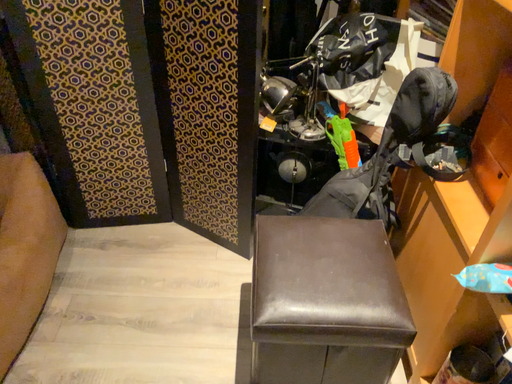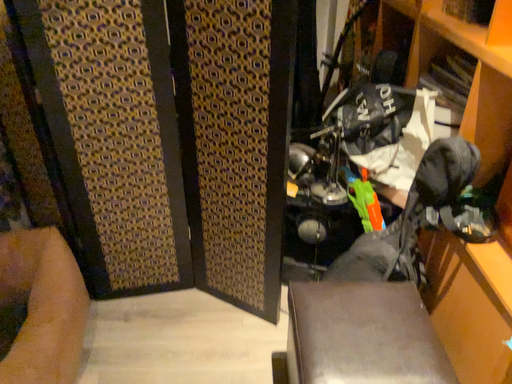
Question: How did the camera likely rotate when shooting the video?

Choices:
 (A) rotated upward
 (B) rotated downward

Answer: (A)